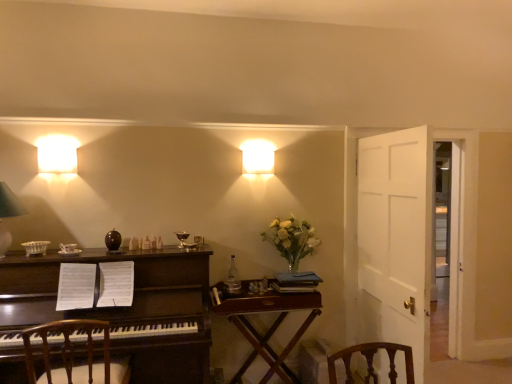
You are a GUI agent. You are given a task and a screenshot of the screen. Output one action in this format:
    pyautogui.click(x=<x>, y=<y>)
    Task: Click on the white matte wall sconce at upper left, marked as the second lamp in a back-to-front arrangement
    
    Given the screenshot: What is the action you would take?
    pyautogui.click(x=57, y=154)

Where is `white wooden door at right`? This screenshot has width=512, height=384. white wooden door at right is located at coordinates (396, 239).

At what (x,y) coordinates should I click in order to perform the action: click on translucent glass vase at upper right. Please return your answer as a coordinate pair (x, y). Image resolution: width=512 pixels, height=384 pixels. Looking at the image, I should click on (292, 240).

What is the approximate height of translucent glass vase at upper right?

The height of translucent glass vase at upper right is 16.31 inches.

Where is `dark wood desk at left`? The height and width of the screenshot is (384, 512). dark wood desk at left is located at coordinates (125, 307).

You are a GUI agent. You are given a task and a screenshot of the screen. Output one action in this format:
    pyautogui.click(x=<x>, y=<y>)
    Task: Click on the white fabric lampshade at upper left, positioned as the third lamp in right-to-left order
    This screenshot has height=384, width=512.
    Given the screenshot: What is the action you would take?
    pyautogui.click(x=7, y=215)

This screenshot has width=512, height=384. What do you see at coordinates (7, 215) in the screenshot?
I see `white fabric lampshade at upper left, the 1th lamp from the front` at bounding box center [7, 215].

Describe the element at coordinates (257, 157) in the screenshot. The image size is (512, 384). I see `matte white square at upper center, the 1th lamp when ordered from back to front` at that location.

The height and width of the screenshot is (384, 512). In order to click on white matte wall sconce at upper left, placed as the second lamp when sorted from right to left in this screenshot , I will do `click(57, 154)`.

Between white wooden door at right and translucent glass vase at upper right, which one has smaller size?

Smaller between the two is translucent glass vase at upper right.

Which is in front, point (394, 323) or point (282, 245)?

Positioned in front is point (394, 323).

How many degrees apart are the facing directions of white wooden door at right and translucent glass vase at upper right?

The angular difference between white wooden door at right and translucent glass vase at upper right is 0.0229 degrees.

From a real-world perspective, which object stands above the other?

white wooden door at right, from a real-world perspective.

In the scene shown: Is white wooden door at right not inside wooden table at center?

Yes, white wooden door at right is located beyond the bounds of wooden table at center.

Image resolution: width=512 pixels, height=384 pixels. I want to click on table in front of the white wooden door at right, so click(x=271, y=325).

Is white wooden door at right behind wooden table at center?

Yes, white wooden door at right is further from the camera.

Between dark wood desk at left and translucent glass vase at upper right, which one appears on the left side from the viewer's perspective?

dark wood desk at left.

Between dark wood desk at left and translucent glass vase at upper right, which one has smaller size?

translucent glass vase at upper right.

From a real-world perspective, is dark wood desk at left under translucent glass vase at upper right?

Yes, from a real-world perspective, dark wood desk at left is below translucent glass vase at upper right.

Considering the positions of point (68, 366) and point (109, 319), is point (68, 366) closer or farther from the camera than point (109, 319)?

Point (68, 366) is positioned closer to the camera compared to point (109, 319).

Would you say wooden chair at left contains dark wood desk at left?

Definitely not — dark wood desk at left is not inside wooden chair at left.

From the image's perspective, would you say wooden chair at left is positioned over dark wood desk at left?

Actually, wooden chair at left appears below dark wood desk at left in the image.

Is wooden chair at left looking in the opposite direction of dark wood desk at left?

wooden chair at left is not turned away from dark wood desk at left.

Considering the positions of objects dark wood desk at left and matte white square at upper center, the 3th lamp in the front-to-back sequence, in the image provided, who is more to the right, dark wood desk at left or matte white square at upper center, the 3th lamp in the front-to-back sequence,?

matte white square at upper center, the 3th lamp in the front-to-back sequence.

Is dark wood desk at left touching matte white square at upper center, which appears as the 1th lamp when viewed from the right?

dark wood desk at left is not next to matte white square at upper center, which appears as the 1th lamp when viewed from the right, and they're not touching.

In the scene shown: Is dark wood desk at left oriented away from matte white square at upper center, the 3th lamp in the front-to-back sequence?

dark wood desk at left is not turned away from matte white square at upper center, the 3th lamp in the front-to-back sequence.

From a real-world perspective, which object rests below the other?

dark wood desk at left, from a real-world perspective.

Is clear glass bottle at center to the right of wooden chair at left from the viewer's perspective?

Yes, clear glass bottle at center is to the right of wooden chair at left.

Does clear glass bottle at center have a larger size compared to wooden chair at left?

Actually, clear glass bottle at center might be smaller than wooden chair at left.

Between point (229, 291) and point (89, 329), which one is positioned in front?

Point (89, 329)

Is clear glass bottle at center oriented away from wooden chair at left?

No, clear glass bottle at center is not facing away from wooden chair at left.

Based on their sizes in the image, would you say white fabric lampshade at upper left, the 1th lamp from the front, is bigger or smaller than white matte wall sconce at upper left, the second lamp ordered from the bottom?

white fabric lampshade at upper left, the 1th lamp from the front, is bigger than white matte wall sconce at upper left, the second lamp ordered from the bottom.

Is white fabric lampshade at upper left, the first lamp from the left, in front of white matte wall sconce at upper left, the second lamp ordered from the bottom?

Yes, it is in front of white matte wall sconce at upper left, the second lamp ordered from the bottom.

Is white fabric lampshade at upper left, the 1th lamp from the bottom, inside or outside of white matte wall sconce at upper left, placed as the second lamp when sorted from right to left?

white fabric lampshade at upper left, the 1th lamp from the bottom, cannot be found inside white matte wall sconce at upper left, placed as the second lamp when sorted from right to left.

In the image, there is a translucent glass vase at upper right. Where is `door below it (from a real-world perspective)`? Image resolution: width=512 pixels, height=384 pixels. door below it (from a real-world perspective) is located at coordinates (396, 239).

Locate an element on the screen. table on the left of white wooden door at right is located at coordinates (271, 325).

When comparing their distances from matte white square at upper center, the 3th lamp in the front-to-back sequence, does white matte wall sconce at upper left, which is counted as the 2th lamp, starting from the top, or white fabric lampshade at upper left, the first lamp from the left, seem further?

Among the two, white fabric lampshade at upper left, the first lamp from the left, is located further to matte white square at upper center, the 3th lamp in the front-to-back sequence.

Looking at this image, estimate the real-world distances between objects in this image. Which object is closer to wooden table at center, translucent glass vase at upper right or dark wood desk at left?

Based on the image, translucent glass vase at upper right appears to be nearer to wooden table at center.

When comparing their distances from wooden table at center, does white matte wall sconce at upper left, marked as the second lamp in a front-to-back arrangement, or matte white square at upper center, the third lamp viewed from the left, seem closer?

Based on the image, matte white square at upper center, the third lamp viewed from the left, appears to be nearer to wooden table at center.

Estimate the real-world distances between objects in this image. Which object is further from matte white square at upper center, marked as the 3th lamp in a bottom-to-top arrangement, clear glass bottle at center or white fabric lampshade at upper left, the 1th lamp from the front?

white fabric lampshade at upper left, the 1th lamp from the front, lies further to matte white square at upper center, marked as the 3th lamp in a bottom-to-top arrangement, than the other object.

Estimate the real-world distances between objects in this image. Which object is further from matte white square at upper center, marked as the 3th lamp in a bottom-to-top arrangement, clear glass bottle at center or white matte wall sconce at upper left, which is counted as the 2th lamp, starting from the top?

white matte wall sconce at upper left, which is counted as the 2th lamp, starting from the top.

Considering their positions, is dark wood desk at left positioned further to white matte wall sconce at upper left, marked as the second lamp in a back-to-front arrangement, than translucent glass vase at upper right?

translucent glass vase at upper right.

Which object lies nearer to the anchor point white fabric lampshade at upper left, the 1th lamp from the front, translucent glass vase at upper right or dark wood desk at left?

Among the two, dark wood desk at left is located nearer to white fabric lampshade at upper left, the 1th lamp from the front.

Estimate the real-world distances between objects in this image. Which object is closer to wooden chair at left, matte white square at upper center, the 3th lamp in the front-to-back sequence, or white matte wall sconce at upper left, marked as the second lamp in a back-to-front arrangement?

white matte wall sconce at upper left, marked as the second lamp in a back-to-front arrangement, is closer to wooden chair at left.

The height and width of the screenshot is (384, 512). In order to click on table between white fabric lampshade at upper left, positioned as the third lamp in right-to-left order, and white wooden door at right, in the horizontal direction in this screenshot , I will do [271, 325].

Find the location of `bottle located between white matte wall sconce at upper left, which is counted as the 2th lamp, starting from the top, and matte white square at upper center, the third lamp viewed from the left, in the left-right direction`. bottle located between white matte wall sconce at upper left, which is counted as the 2th lamp, starting from the top, and matte white square at upper center, the third lamp viewed from the left, in the left-right direction is located at coordinates (233, 279).

Where is `bottle between white fabric lampshade at upper left, placed as the third lamp when sorted from top to bottom, and translucent glass vase at upper right`? bottle between white fabric lampshade at upper left, placed as the third lamp when sorted from top to bottom, and translucent glass vase at upper right is located at coordinates (233, 279).

You are a GUI agent. You are given a task and a screenshot of the screen. Output one action in this format:
    pyautogui.click(x=<x>, y=<y>)
    Task: Click on the bottle between white matte wall sconce at upper left, which is counted as the 2th lamp, starting from the top, and translucent glass vase at upper right, in the horizontal direction
    The width and height of the screenshot is (512, 384).
    Given the screenshot: What is the action you would take?
    pyautogui.click(x=233, y=279)